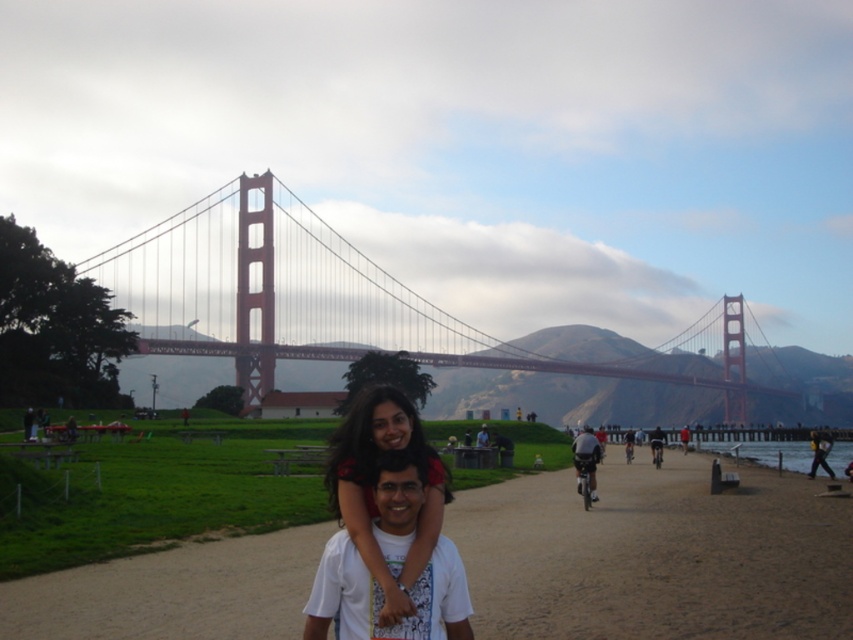
Question: Is dark gray helmet at center bigger than dark brown leather jacket at center?

Choices:
 (A) no
 (B) yes

Answer: (B)

Question: Which of the following is the farthest from the observer?

Choices:
 (A) matte black bicycle at center
 (B) smooth sand path at center
 (C) painted steel golden gate bridge at center

Answer: (C)

Question: Estimate the real-world distances between objects in this image. Which object is farther from the painted steel golden gate bridge at center?

Choices:
 (A) dark brown leather jacket at center
 (B) smooth sand path at center

Answer: (A)

Question: Can you confirm if matte black bicycle at center is positioned below dark brown leather jacket at center?

Choices:
 (A) yes
 (B) no

Answer: (A)

Question: Among these objects, which one is nearest to the camera?

Choices:
 (A) painted steel golden gate bridge at center
 (B) smooth sand path at center
 (C) dark gray helmet at center
 (D) matte black hair at center

Answer: (D)

Question: Can you confirm if matte black bicycle at center is positioned below dark brown leather jacket at center?

Choices:
 (A) yes
 (B) no

Answer: (A)